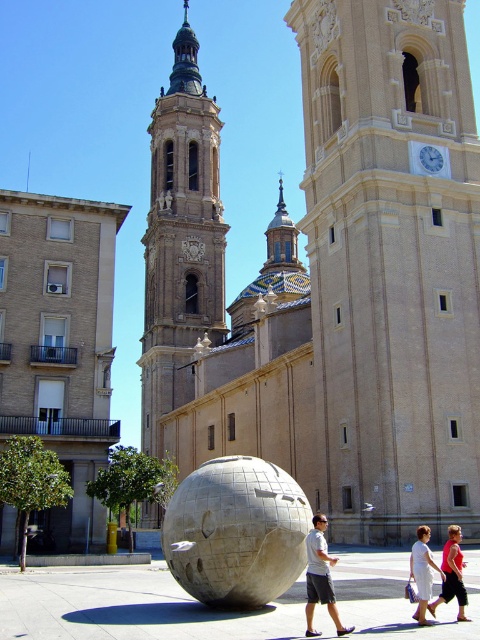
You are standing on the paved plaza and want to take a photo of the beige stone church at center and the stone sphere at center. Which object should you position to your left to include both in the frame?

The beige stone church at center is to the right of the stone sphere at center, so you should position the stone sphere at center to your left to include both in the frame.

You are standing in the plaza and want to take a photo of the brown brick church at left without including the matte pink shirt at center in the frame. Is the church wider than the shirt?

The brown brick church at left might be wider than matte pink shirt at center, so there is a possibility that the church is wider. However, since the exact width comparison is uncertain, it is advisable to adjust your position to ensure the matte pink shirt at center is out of the frame.

You are standing in the plaza and want to take a photo of the stone sphere at center and the white cotton dress at lower center. Which object should you focus on first to ensure it appears sharp in your photo?

You should focus on the stone sphere at center first because it is closer to you than the white cotton dress at lower center, so adjusting focus from near to far will help both appear sharp.